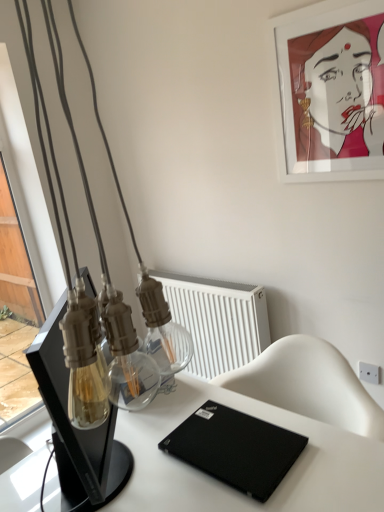
Question: Is black matte laptop at center smaller than clear glass bottle at center?

Choices:
 (A) yes
 (B) no

Answer: (B)

Question: Can you confirm if black matte laptop at center is thinner than clear glass bottle at center?

Choices:
 (A) yes
 (B) no

Answer: (B)

Question: Does black matte laptop at center lie behind clear glass bottle at center?

Choices:
 (A) yes
 (B) no

Answer: (B)

Question: From the image's perspective, is black matte laptop at center beneath clear glass bottle at center?

Choices:
 (A) no
 (B) yes

Answer: (B)

Question: Does black matte laptop at center appear on the right side of clear glass bottle at center?

Choices:
 (A) yes
 (B) no

Answer: (A)

Question: Considering the positions of white plastic radiator at center and white plastic electric outlet at upper right in the image, is white plastic radiator at center wider or thinner than white plastic electric outlet at upper right?

Choices:
 (A) wide
 (B) thin

Answer: (A)

Question: From their relative heights in the image, would you say white plastic radiator at center is taller or shorter than white plastic electric outlet at upper right?

Choices:
 (A) short
 (B) tall

Answer: (B)

Question: Considering the positions of white plastic radiator at center and white plastic electric outlet at upper right in the image, is white plastic radiator at center bigger or smaller than white plastic electric outlet at upper right?

Choices:
 (A) big
 (B) small

Answer: (A)

Question: Is white plastic radiator at center spatially inside white plastic electric outlet at upper right, or outside of it?

Choices:
 (A) inside
 (B) outside

Answer: (B)

Question: Is clear glass bottle at center taller or shorter than black matte laptop at center?

Choices:
 (A) tall
 (B) short

Answer: (B)

Question: From the image's perspective, is clear glass bottle at center positioned above or below black matte laptop at center?

Choices:
 (A) below
 (B) above

Answer: (B)

Question: Does point (127, 311) appear closer or farther from the camera than point (158, 478)?

Choices:
 (A) closer
 (B) farther

Answer: (A)

Question: Looking at the image, does clear glass bottle at center seem bigger or smaller compared to black matte laptop at center?

Choices:
 (A) small
 (B) big

Answer: (A)

Question: Is white plastic electric outlet at upper right wider or thinner than black matte laptop at lower right?

Choices:
 (A) wide
 (B) thin

Answer: (B)

Question: Does point (362, 366) appear closer or farther from the camera than point (246, 483)?

Choices:
 (A) farther
 (B) closer

Answer: (A)